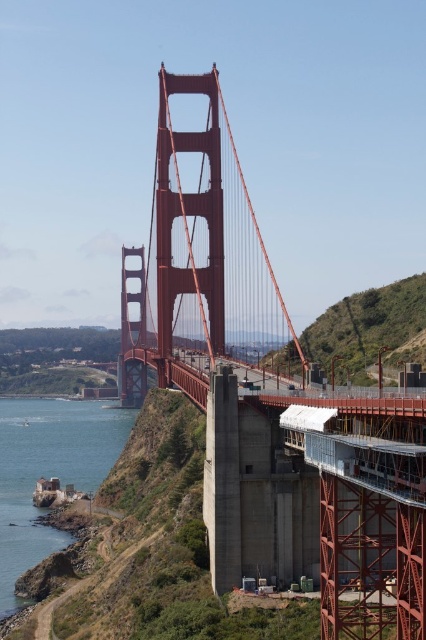
Is matte steel suspension bridge at center shorter than clear blue water at lower left?

In fact, matte steel suspension bridge at center may be taller than clear blue water at lower left.

Is point (224, 577) closer to camera compared to point (88, 442)?

Yes, it is.

The image size is (426, 640). In order to click on matte steel suspension bridge at center in this screenshot , I will do `click(270, 401)`.